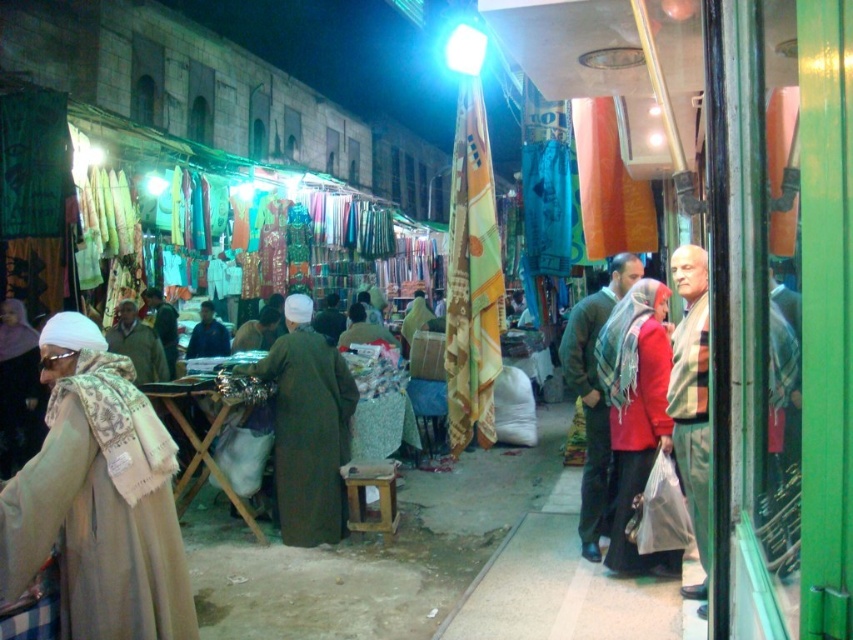
Question: Does light brown fabric at right appear on the left side of brown woolen jacket at center?

Choices:
 (A) no
 (B) yes

Answer: (A)

Question: Is light brown fabric at right thinner than brown woolen jacket at center?

Choices:
 (A) no
 (B) yes

Answer: (B)

Question: Among these points, which one is farthest from the camera?

Choices:
 (A) (9, 556)
 (B) (599, 294)
 (C) (184, 352)
 (D) (117, 310)

Answer: (C)

Question: Which of these objects is positioned farthest from the beige woolen scarf at left?

Choices:
 (A) brown woolen jacket at center
 (B) green woolen sweater at center
 (C) light brown fabric at right
 (D) red matte scarf at center

Answer: (A)

Question: Does beige woolen scarf at left have a smaller size compared to brown woolen robe at center?

Choices:
 (A) yes
 (B) no

Answer: (A)

Question: Which point is closer to the camera taking this photo?

Choices:
 (A) [347, 397]
 (B) [165, 371]

Answer: (A)